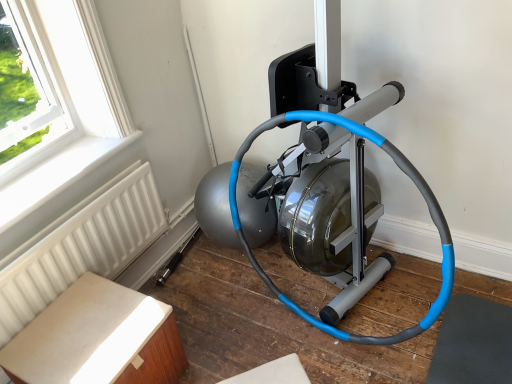
You are a GUI agent. You are given a task and a screenshot of the screen. Output one action in this format:
    pyautogui.click(x=<x>, y=<y>)
    Task: Click on the free space above light brown wood table at lower left (from a real-world perspective)
    This screenshot has width=512, height=384.
    Given the screenshot: What is the action you would take?
    pyautogui.click(x=80, y=334)